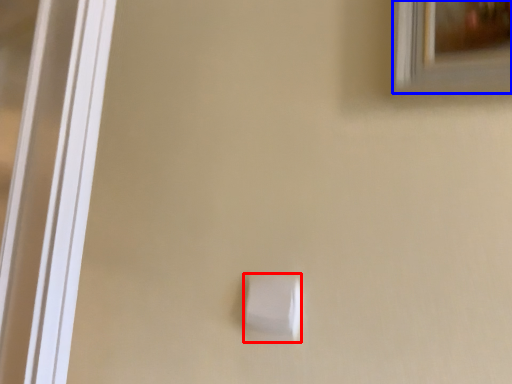
Question: Which of the following is the farthest to the observer, light switch (highlighted by a red box) or window (highlighted by a blue box)?

Choices:
 (A) light switch
 (B) window

Answer: (A)